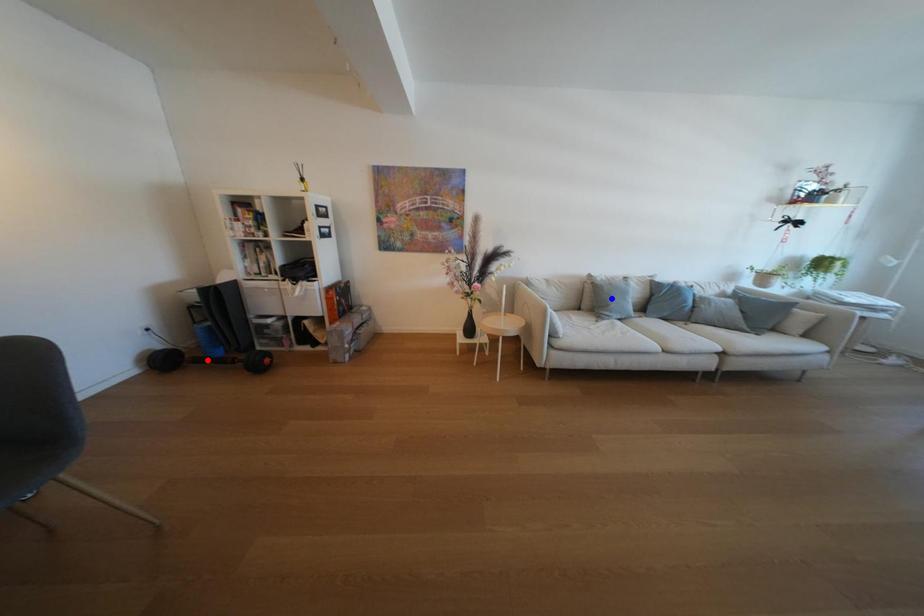
Question: Two points are marked on the image. Which point is closer to the camera?

Choices:
 (A) Blue point is closer.
 (B) Red point is closer.

Answer: (B)